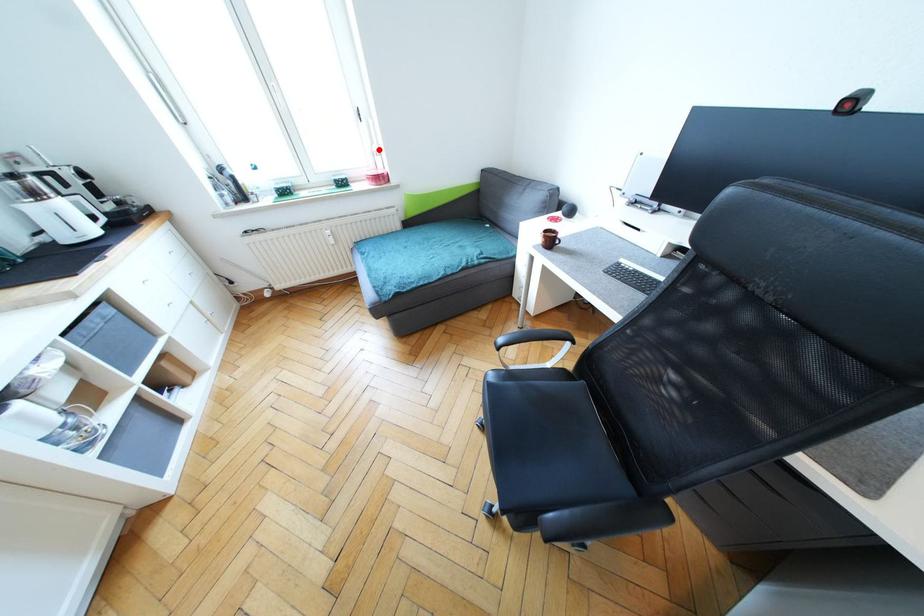
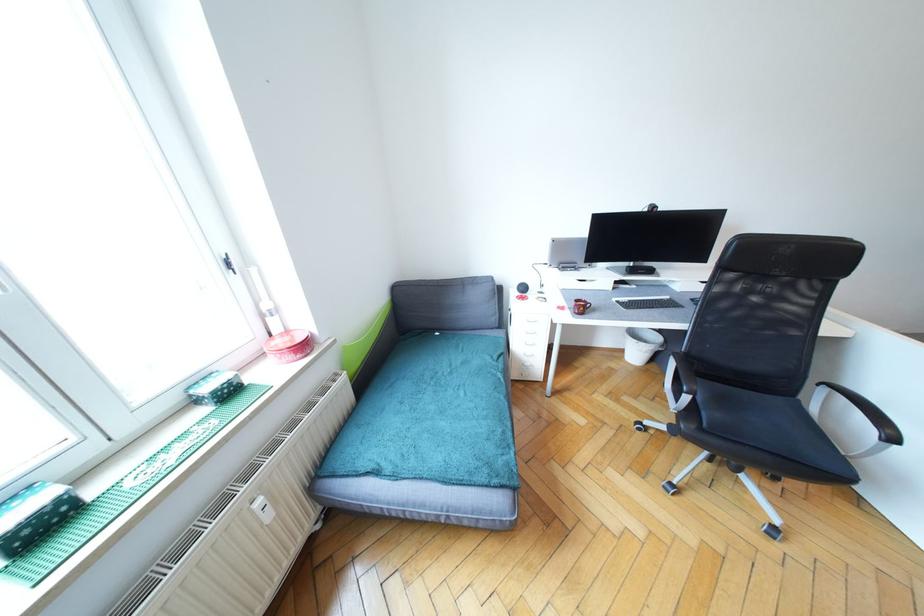
Find the pixel in the second image that matches the highlighted location in the first image.

(270, 307)